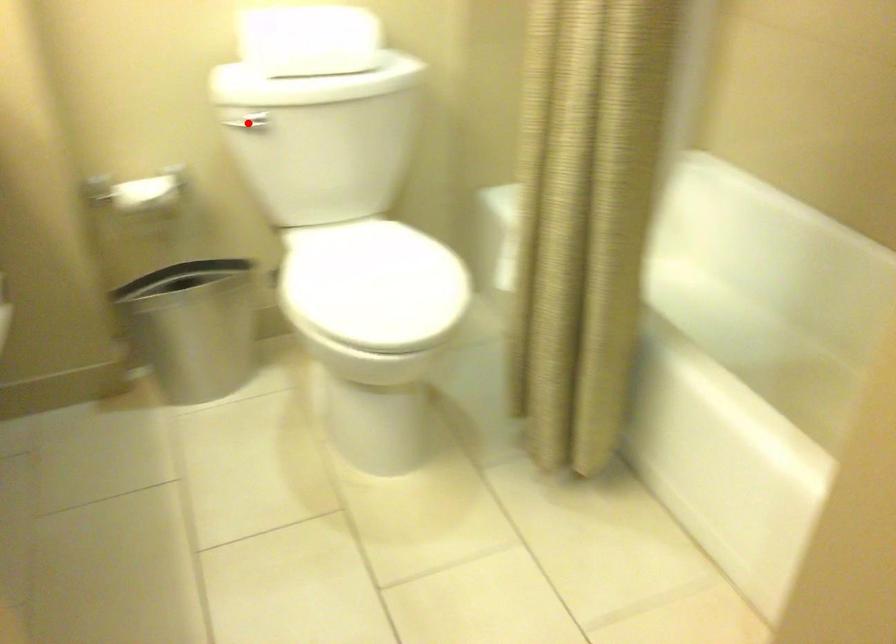
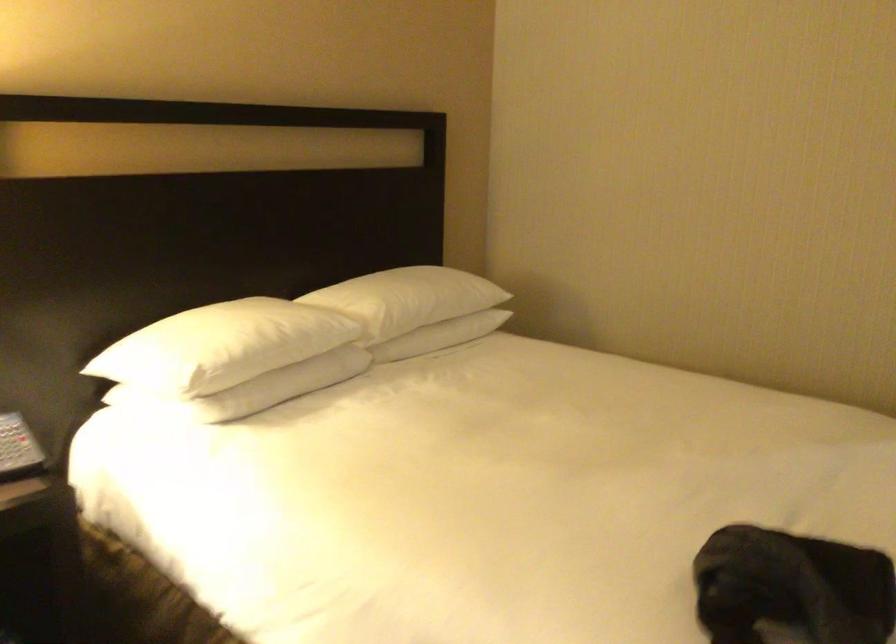
Question: I am providing you with two images of the same scene from different viewpoints. A red point is marked on the first image. Can you still see the location of the red point in image 2?

Choices:
 (A) Yes
 (B) No

Answer: (B)